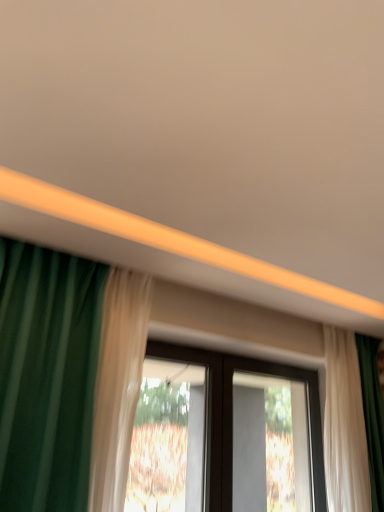
Where is `white sheer curtain at right`? The width and height of the screenshot is (384, 512). white sheer curtain at right is located at coordinates (344, 426).

From the image's perspective, is transparent glass window at center over black plastic screen door at center?

Indeed, from the image's perspective, transparent glass window at center is shown above black plastic screen door at center.

Considering the relative sizes of transparent glass window at center and black plastic screen door at center in the image provided, is transparent glass window at center smaller than black plastic screen door at center?

Correct, transparent glass window at center occupies less space than black plastic screen door at center.

Is transparent glass window at center to the left or to the right of black plastic screen door at center in the image?

Clearly, transparent glass window at center is on the left of black plastic screen door at center in the image.

Which is in front, point (314, 462) or point (234, 358)?

Point (234, 358)

Which is closer, (314, 406) or (359, 376)?

Point (314, 406) is farther from the camera than point (359, 376).

The width and height of the screenshot is (384, 512). In order to click on window lying above the white sheer curtain at right (from the image's perspective) in this screenshot , I will do `click(232, 411)`.

Can you confirm if transparent glass window at center is shorter than white sheer curtain at right?

Correct, transparent glass window at center is not as tall as white sheer curtain at right.

Would you say transparent glass window at center is to the left or to the right of white sheer curtain at right in the picture?

transparent glass window at center is positioned on white sheer curtain at right's left side.

From a real-world perspective, is white sheer curtain at right physically above black plastic screen door at center?

Yes.

Is white sheer curtain at right at the right side of black plastic screen door at center?

Yes, white sheer curtain at right is to the right of black plastic screen door at center.

Are white sheer curtain at right and black plastic screen door at center far apart?

Actually, white sheer curtain at right and black plastic screen door at center are a little close together.

Is point (363, 419) closer or farther from the camera than point (270, 429)?

Point (363, 419) is positioned closer to the camera compared to point (270, 429).

Could you tell me if black plastic screen door at center is turned towards transparent glass window at center?

No, black plastic screen door at center is not oriented towards transparent glass window at center.

Which is behind, point (279, 484) or point (251, 369)?

Positioned behind is point (279, 484).

Which of these two, black plastic screen door at center or transparent glass window at center, is bigger?

Bigger between the two is black plastic screen door at center.

Is black plastic screen door at center outside of transparent glass window at center?

That's correct, black plastic screen door at center is outside of transparent glass window at center.

Locate an element on the screen. Image resolution: width=384 pixels, height=512 pixels. screen door lying on the left of white sheer curtain at right is located at coordinates (271, 438).

Is black plastic screen door at center completely or partially outside of white sheer curtain at right?

Yes.

Considering the relative sizes of black plastic screen door at center and white sheer curtain at right in the image provided, is black plastic screen door at center wider than white sheer curtain at right?

No.

Between white sheer curtain at right and transparent glass window at center, which one appears on the right side from the viewer's perspective?

white sheer curtain at right.

Does white sheer curtain at right have a greater height compared to transparent glass window at center?

Correct, white sheer curtain at right is much taller as transparent glass window at center.

Looking at this image, in terms of width, does white sheer curtain at right look wider or thinner when compared to transparent glass window at center?

In the image, white sheer curtain at right appears to be wider than transparent glass window at center.

Locate an element on the screen. The image size is (384, 512). window lying in front of the black plastic screen door at center is located at coordinates (232, 411).

Where is `curtain located on the right of transparent glass window at center`? curtain located on the right of transparent glass window at center is located at coordinates (344, 426).

Estimate the real-world distances between objects in this image. Which object is further from white sheer curtain at right, transparent glass window at center or black plastic screen door at center?

black plastic screen door at center is positioned further to the anchor white sheer curtain at right.

Which object lies nearer to the anchor point transparent glass window at center, white sheer curtain at right or black plastic screen door at center?

Based on the image, white sheer curtain at right appears to be nearer to transparent glass window at center.

Considering their positions, is black plastic screen door at center positioned closer to white sheer curtain at right than transparent glass window at center?

transparent glass window at center is closer to white sheer curtain at right.

Looking at the image, which one is located closer to transparent glass window at center, black plastic screen door at center or white sheer curtain at right?

Based on the image, white sheer curtain at right appears to be nearer to transparent glass window at center.

Based on their spatial positions, is transparent glass window at center or white sheer curtain at right further from black plastic screen door at center?

white sheer curtain at right lies further to black plastic screen door at center than the other object.

Which object lies further to the anchor point black plastic screen door at center, white sheer curtain at right or transparent glass window at center?

white sheer curtain at right is further to black plastic screen door at center.

The image size is (384, 512). I want to click on screen door located between transparent glass window at center and white sheer curtain at right in the left-right direction, so click(x=271, y=438).